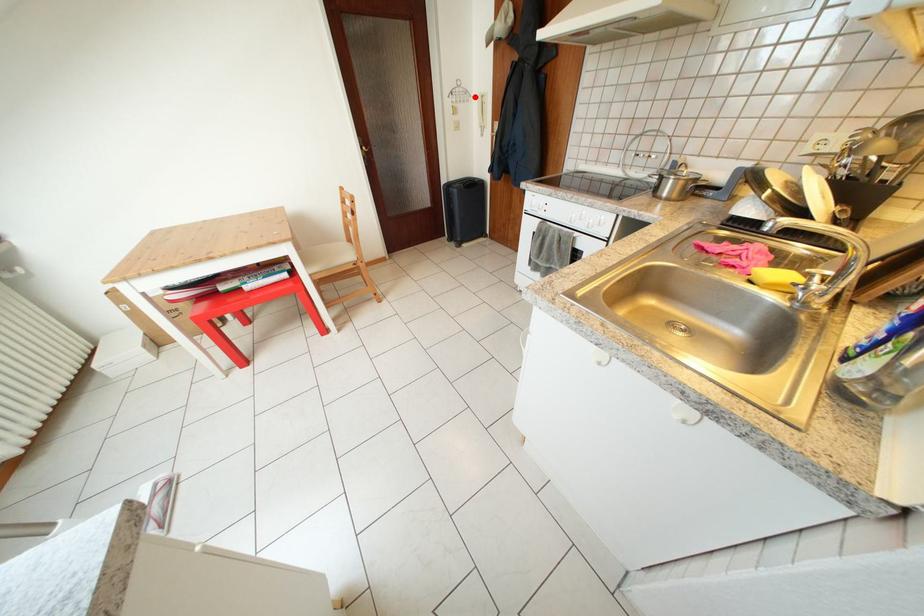
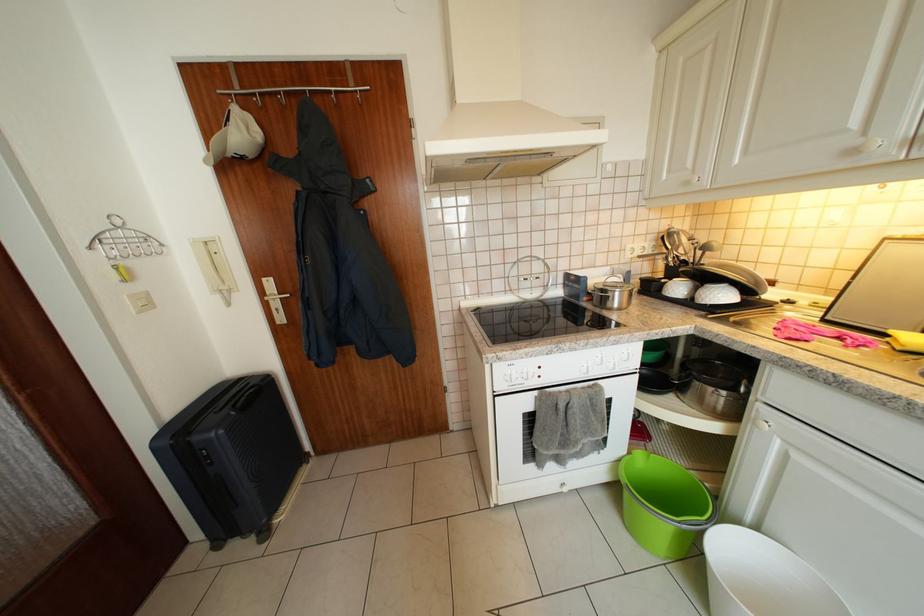
Where in the second image is the point corresponding to the highlighted location from the first image?

(156, 243)